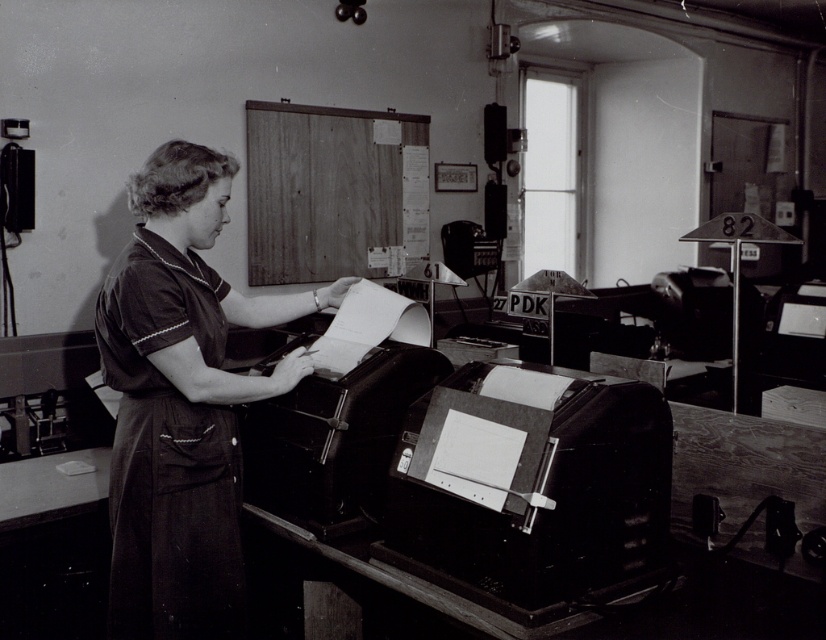
Can you confirm if metallic black printer at lower center is positioned to the left of metallic paper at center?

Incorrect, metallic black printer at lower center is not on the left side of metallic paper at center.

How far apart are metallic black printer at lower center and metallic paper at center?

They are 40.63 centimeters apart.

Where is `metallic black printer at lower center`? This screenshot has width=826, height=640. metallic black printer at lower center is located at coordinates (532, 490).

I want to click on metallic black printer at lower center, so point(532,490).

Can you confirm if dark fabric apron at center is thinner than metallic paper at center?

Yes.

Does dark fabric apron at center appear on the right side of metallic paper at center?

Incorrect, dark fabric apron at center is not on the right side of metallic paper at center.

I want to click on dark fabric apron at center, so click(169, 452).

Who is positioned more to the right, matte black dress at center or dark fabric apron at center?

matte black dress at center is more to the right.

The image size is (826, 640). What do you see at coordinates (181, 401) in the screenshot? I see `matte black dress at center` at bounding box center [181, 401].

Is point (114, 541) farther from camera compared to point (198, 586)?

Yes.

The width and height of the screenshot is (826, 640). I want to click on matte black dress at center, so click(x=181, y=401).